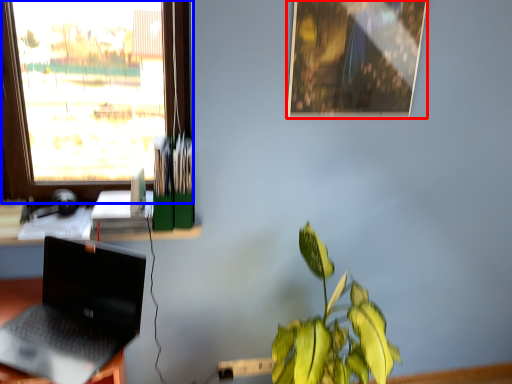
Question: Which object appears farthest to the camera in this image, picture frame (highlighted by a red box) or window (highlighted by a blue box)?

Choices:
 (A) picture frame
 (B) window

Answer: (A)